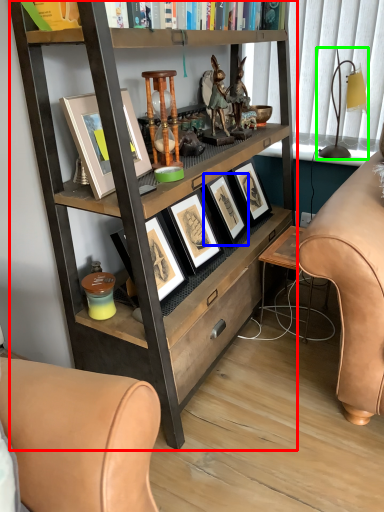
Question: Considering the real-world distances, which object is farthest from bookcase (highlighted by a red box)? picture frame (highlighted by a blue box) or table lamp (highlighted by a green box)?

Choices:
 (A) picture frame
 (B) table lamp

Answer: (B)